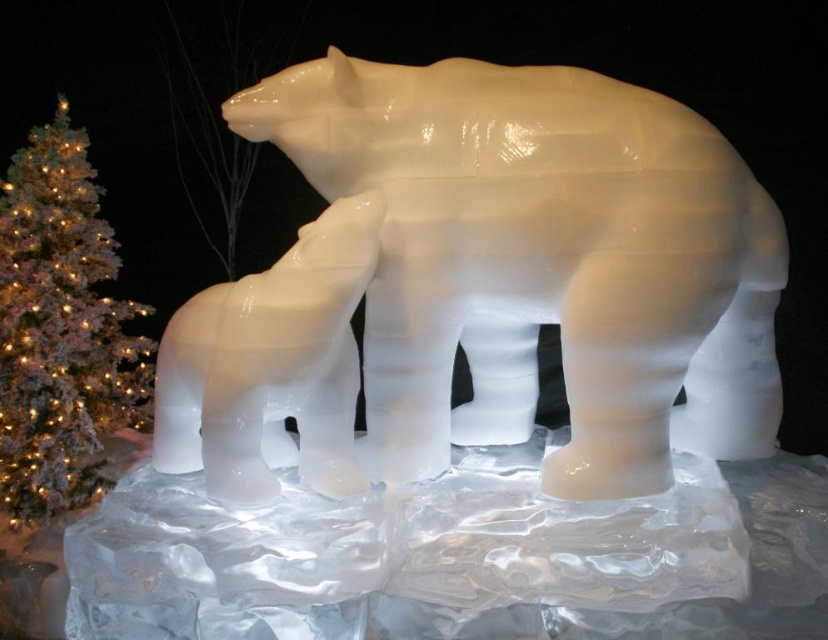
You are at a winter festival and see the white ice bear at center and the white frosted christmas tree at left. Which object is positioned lower in the scene?

The white ice bear at center is located below white frosted christmas tree at left, so the white ice bear at center is positioned lower in the scene.

You are an event planner arranging a winter gala and need to place a decorative snow globe on a table near the white ice sculpture at center and the white ice bear at center. Where should you place the snow globe so it won not block the view of both objects?

The snow globe should be placed below the white ice sculpture at center and the white ice bear at center since the white ice sculpture at center is located above the white ice bear at center, so placing it below would keep it out of the viewing path.

You are at a holiday event and want to take a photo of both the white ice sculpture at center and the white frosted christmas tree at left. Since you have a camera with a limited zoom, you need to know which one is shorter to ensure both fit in the frame. Can you tell me which is shorter?

The white ice sculpture at center is shorter than the white frosted christmas tree at left, so you should position the camera to focus on the white frosted christmas tree at left and include the shorter white ice sculpture at center in the frame.